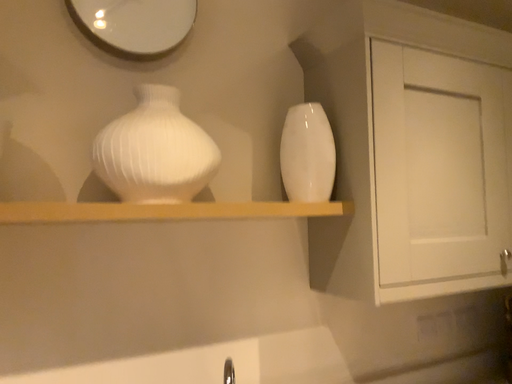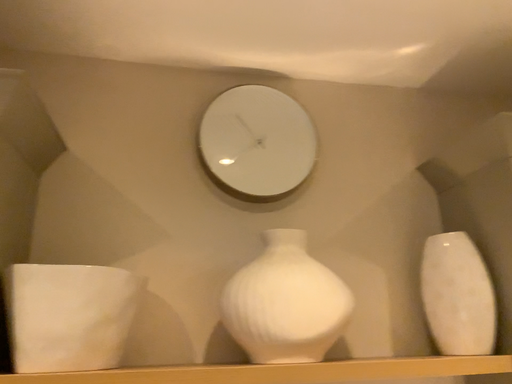
Question: Which way did the camera rotate in the video?

Choices:
 (A) rotated downward
 (B) rotated upward

Answer: (B)